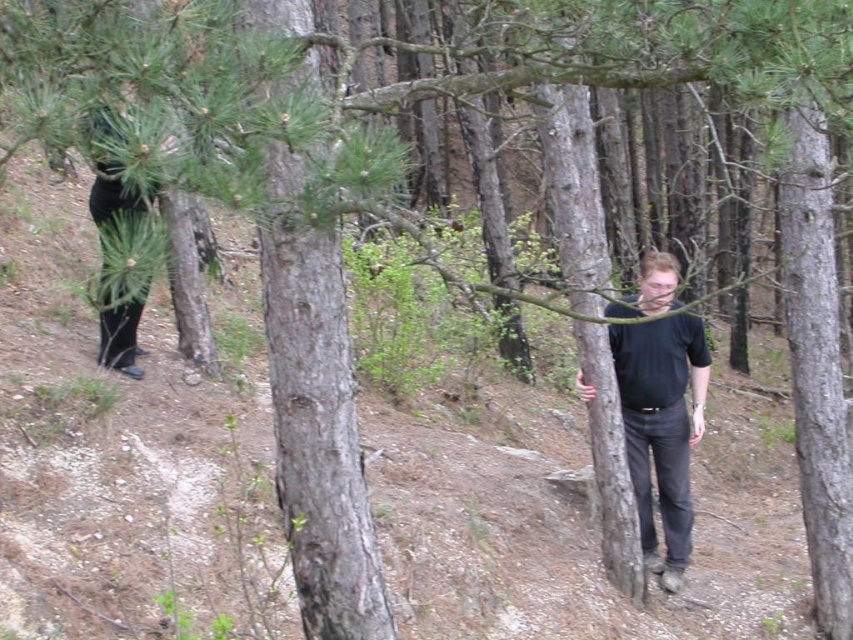
You are a hiker who wants to identify the clothing items in the forest scene. Which clothing item, the black matte shirt at center or the black matte pants at left, takes up more space in the image?

Answer: The black matte shirt at center takes up more space in the image because it is larger in size than the black matte pants at left.

You are a hiker trying to locate a person in the forest. You see the point at coordinates (660, 428). What object is located at that point?

The point at coordinates (660, 428) represents the black matte shirt at center.

You are a photographer trying to capture a subject wearing a black matte shirt at center. You are holding a camera that has a maximum focus range of 5 meters. Can you clearly capture the subject from your current position?

The black matte shirt at center and camera are 5.72 meters apart, which exceeds the camera maximum focus range of 5 meters. Therefore, you cannot clearly capture the subject from your current position.